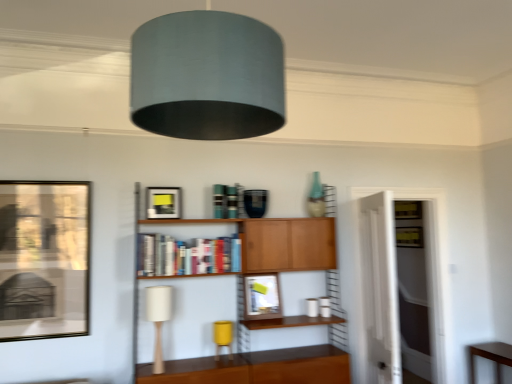
This screenshot has height=384, width=512. Find the location of `vacant area on top of matte black picture frame at left, the 3th picture frame from the back (from a real-world perspective)`. vacant area on top of matte black picture frame at left, the 3th picture frame from the back (from a real-world perspective) is located at coordinates (48, 179).